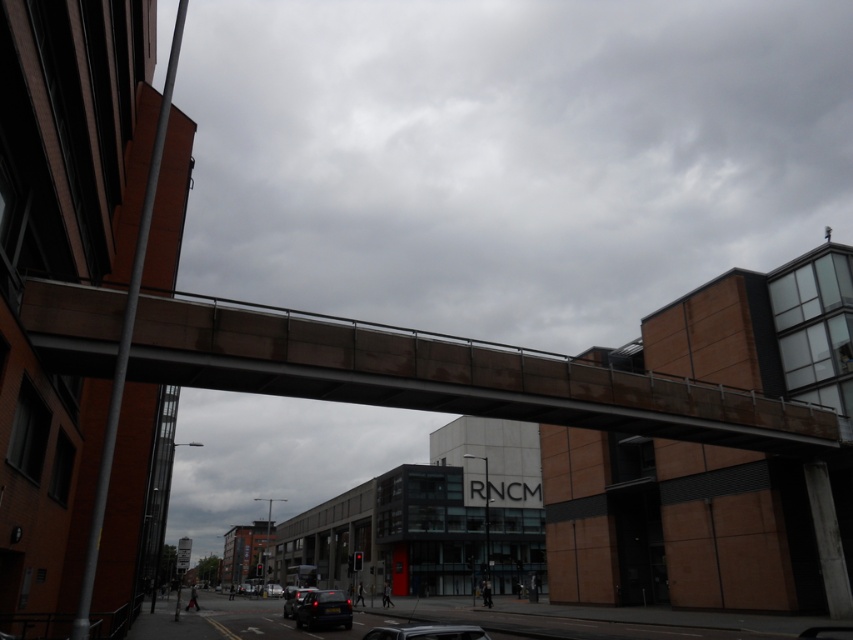
You are a delivery person who needs to park your metallic silver car at center in a designated parking spot located at point 0.989, 0.501. Is your current position already aligned with the parking spot?

Yes, the metallic silver car at center is already positioned at point (426, 632), so it is correctly aligned with the parking spot.

What is located at the coordinates point (323, 609) in the image?

The point (323, 609) indicates a matte black car at lower center.

In the scene shown: You are a delivery person standing at the camera position looking at the urban scene. You need to deliver a package to the RNCM building on the right. The bridge is the only path to reach it. Can you estimate how far the matte black car at lower center is from your current position?

The matte black car at lower center is 20.78 meters from the camera, so it is approximately 20.78 meters away from your current position.